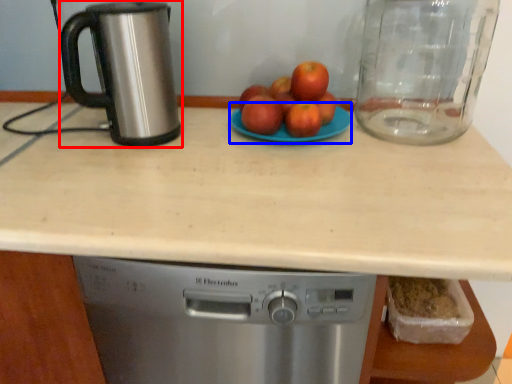
Question: Which object appears farthest to the camera in this image, kitchen appliance (highlighted by a red box) or glass plate (highlighted by a blue box)?

Choices:
 (A) kitchen appliance
 (B) glass plate

Answer: (B)